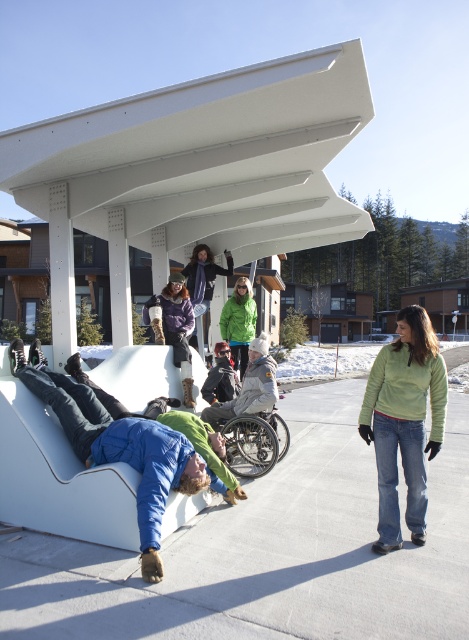
Is gray fabric wheelchair at center below green fleece jacket at center?

Yes.

Is gray fabric wheelchair at center shorter than green fleece jacket at center?

Yes.

Which is behind, point (210, 413) or point (189, 257)?

Point (189, 257)

This screenshot has height=640, width=469. What are the coordinates of `gray fabric wheelchair at center` in the screenshot? It's located at [249, 385].

Which is behind, point (259, 472) or point (265, 349)?

Positioned behind is point (265, 349).

Who is higher up, silver metallic wheelchair at center or gray fabric wheelchair at center?

gray fabric wheelchair at center

Between point (254, 417) and point (255, 396), which one is positioned behind?

The point (255, 396) is more distant.

Where is `silver metallic wheelchair at center`? silver metallic wheelchair at center is located at coordinates (254, 442).

Can you confirm if silver metallic wheelchair at center is positioned above dark gray fleece jacket at center?

No.

Identify the location of silver metallic wheelchair at center. This screenshot has width=469, height=640. (254, 442).

Identify the location of silver metallic wheelchair at center. (254, 442).

Find the location of a particular element. silver metallic wheelchair at center is located at coordinates (254, 442).